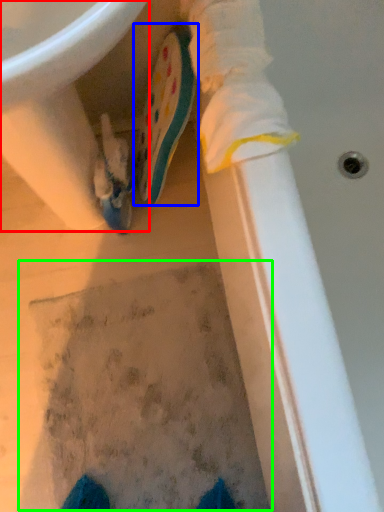
Question: Considering the real-world distances, which object is farthest from sink (highlighted by a red box)? footwear (highlighted by a blue box) or footprint (highlighted by a green box)?

Choices:
 (A) footwear
 (B) footprint

Answer: (B)